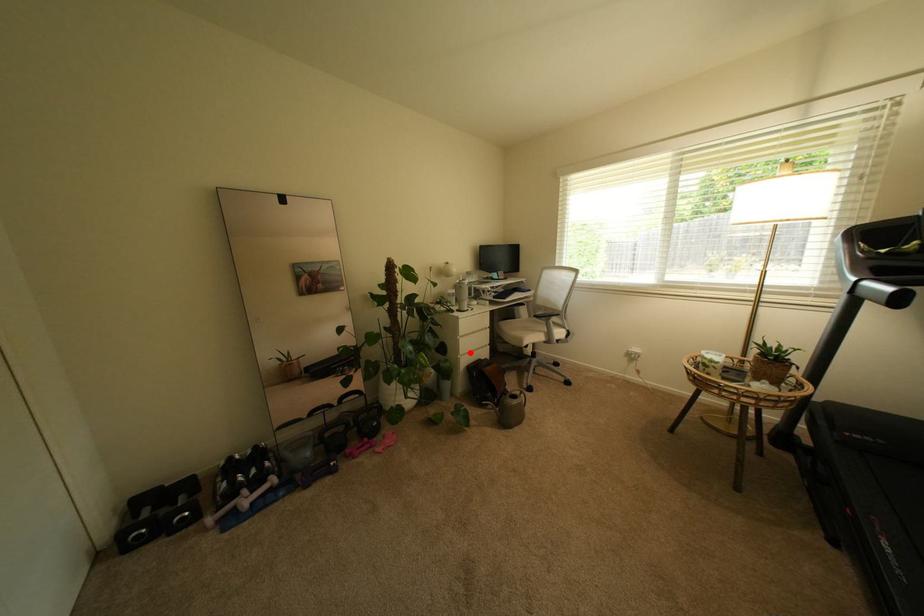
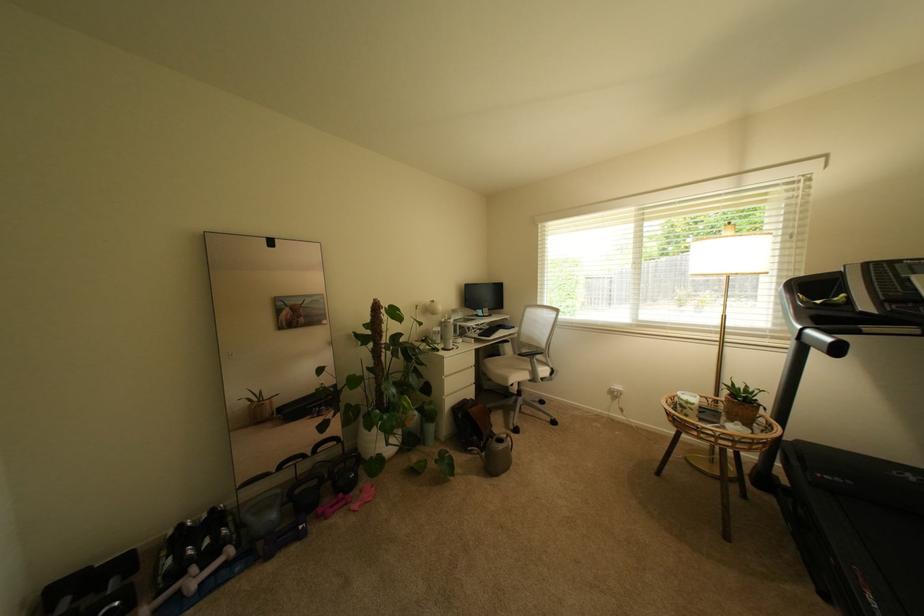
Find the pixel in the second image that matches the highlighted location in the first image.

(455, 392)